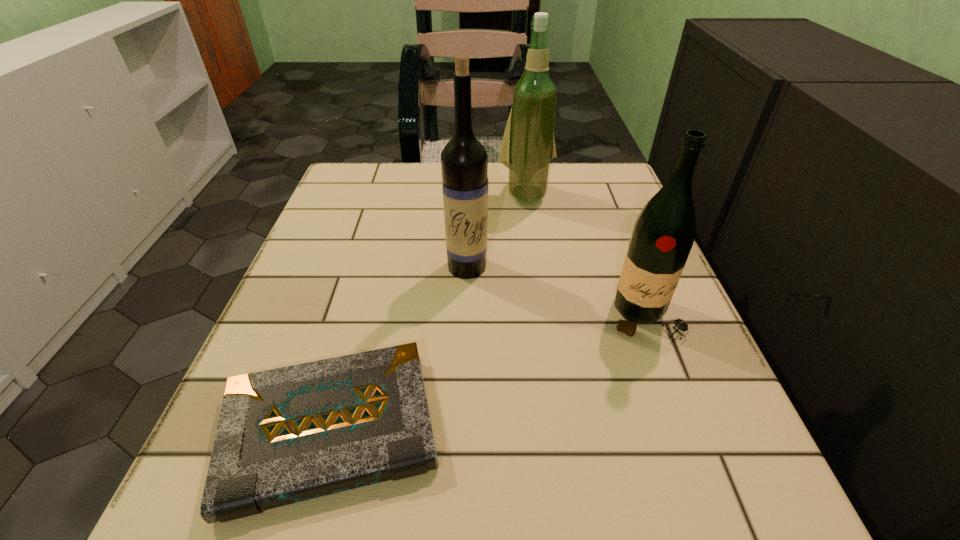
The image size is (960, 540). Find the location of `object that can be found as the closest to the second shortest object`. object that can be found as the closest to the second shortest object is located at coordinates (464, 161).

Select which object is the second closest to the second farthest wine bottle. Please provide its 2D coordinates. Your answer should be formatted as a tuple, i.e. [(x, y)], where the tuple contains the x and y coordinates of a point satisfying the conditions above.

[(290, 434)]

Identify the location of the closest wine bottle to the second shortest object. The width and height of the screenshot is (960, 540). (464, 161).

Find the location of a particular element. This screenshot has height=540, width=960. wine bottle that stands as the second closest to the rightmost object is located at coordinates (528, 145).